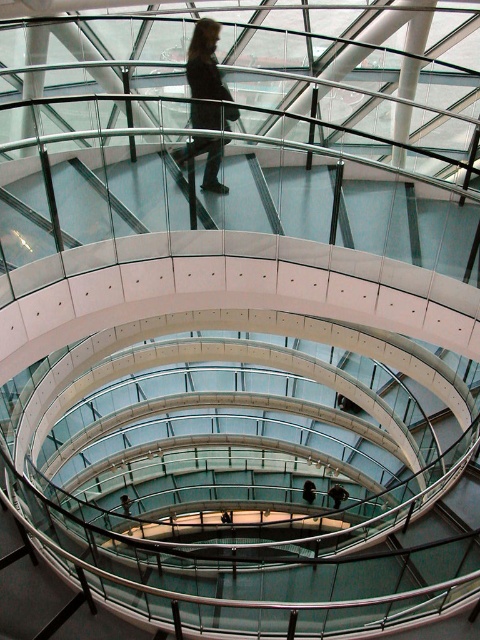
You are an architect designing a maintenance robot for this spiral staircase. The robot needs to travel from the dark brown leather jacket at center to the dark brown leather jacket at upper center. What is the vertical distance the robot must climb?

The vertical distance between the dark brown leather jacket at center and the dark brown leather jacket at upper center is 17.05 meters, so the robot must climb 17.05 meters.